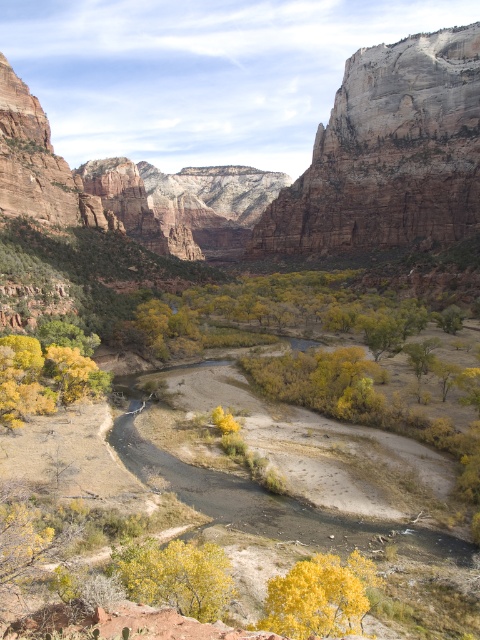
Is yellow matte tree at center smaller than yellow matte tree at left?

Correct, yellow matte tree at center occupies less space than yellow matte tree at left.

Can you confirm if yellow matte tree at center is positioned above yellow matte tree at left?

No.

Does point (334, 557) come in front of point (37, 392)?

Yes, point (334, 557) is closer to viewer.

Locate an element on the screen. The height and width of the screenshot is (640, 480). yellow matte tree at center is located at coordinates (320, 596).

Can you confirm if yellow matte tree at center is positioned to the right of yellow leafy tree at lower center?

Correct, you'll find yellow matte tree at center to the right of yellow leafy tree at lower center.

Can you confirm if yellow matte tree at center is taller than yellow leafy tree at lower center?

Indeed, yellow matte tree at center has a greater height compared to yellow leafy tree at lower center.

At what (x,y) coordinates should I click in order to perform the action: click on yellow matte tree at center. Please return your answer as a coordinate pair (x, y). Looking at the image, I should click on (320, 596).

Is point (187, 545) closer to camera compared to point (88, 371)?

Yes, it is in front of point (88, 371).

Who is more distant from viewer, (132, 586) or (60, 365)?

The point (60, 365) is behind.

Locate an element on the screen. yellow leafy tree at lower center is located at coordinates (177, 577).